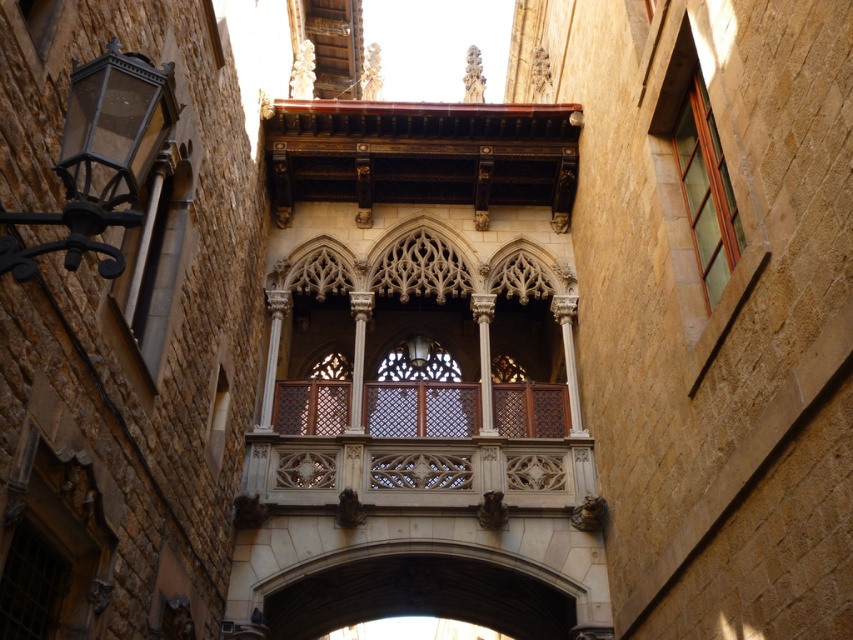
Question: Based on their relative distances, which object is nearer to the matte glass window at upper right?

Choices:
 (A) matte black lantern at upper left
 (B) white stone balcony at center
 (C) wooden-framed glass window at upper right
 (D) matte glass window at left

Answer: (C)

Question: Observing the image, what is the correct spatial positioning of white stone balcony at center in reference to matte black lantern at upper left?

Choices:
 (A) right
 (B) left

Answer: (A)

Question: Is matte black lantern at upper left below wooden-framed glass window at upper right?

Choices:
 (A) no
 (B) yes

Answer: (B)

Question: Which point is farther to the camera?

Choices:
 (A) (309, 356)
 (B) (712, 147)

Answer: (A)

Question: Which object is positioned closest to the wooden-framed glass window at upper right?

Choices:
 (A) polished wood balcony at center
 (B) matte black lantern at upper left

Answer: (A)

Question: From the image, what is the correct spatial relationship of matte glass window at upper right in relation to matte glass window at left?

Choices:
 (A) below
 (B) above

Answer: (B)